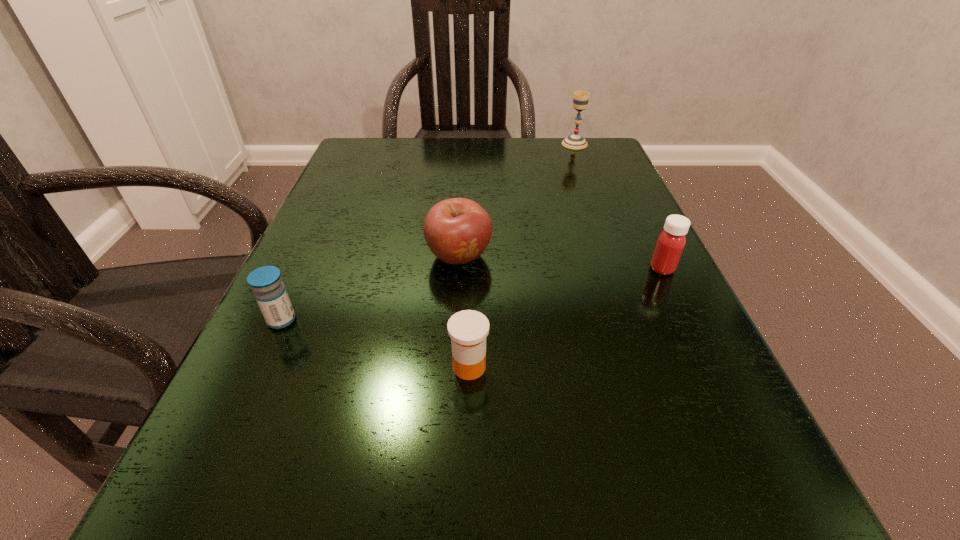
The image size is (960, 540). In order to click on free spot between the apple and the rightmost medicine in this screenshot , I will do `click(561, 262)`.

Find the location of a particular element. Image resolution: width=960 pixels, height=540 pixels. vacant space that is in between the leftmost medicine and the rightmost medicine is located at coordinates (472, 294).

The image size is (960, 540). I want to click on free space between the rightmost object and the apple, so click(x=561, y=262).

Where is `object that is the nearest to the apple`? object that is the nearest to the apple is located at coordinates (468, 329).

Where is `the second closest object to the rightmost medicine`? This screenshot has width=960, height=540. the second closest object to the rightmost medicine is located at coordinates (468, 329).

Select which medicine appears as the second closest to the farthest object. Please provide its 2D coordinates. Your answer should be formatted as a tuple, i.e. [(x, y)], where the tuple contains the x and y coordinates of a point satisfying the conditions above.

[(468, 329)]

This screenshot has height=540, width=960. Identify the location of the second closest medicine to the nearest object. (670, 244).

Locate an element on the screen. Image resolution: width=960 pixels, height=540 pixels. vacant position in the image that satisfies the following two spatial constraints: 1. on the front side of the rightmost medicine; 2. on the right side of the tallest object is located at coordinates [x=622, y=268].

The width and height of the screenshot is (960, 540). I want to click on vacant space that satisfies the following two spatial constraints: 1. on the back side of the leftmost object; 2. on the right side of the tallest object, so click(x=364, y=144).

The image size is (960, 540). In order to click on free space in the image that satisfies the following two spatial constraints: 1. on the side of the apple with the unique marking; 2. on the left side of the rightmost medicine in this screenshot , I will do `click(459, 268)`.